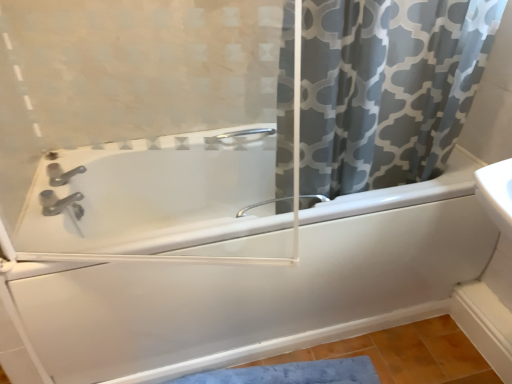
Describe the element at coordinates (251, 291) in the screenshot. This screenshot has width=512, height=384. I see `white glossy bathtub at center` at that location.

What do you see at coordinates (61, 203) in the screenshot? The height and width of the screenshot is (384, 512). I see `satin nickel faucet at lower left` at bounding box center [61, 203].

Locate an element on the screen. This screenshot has width=512, height=384. satin nickel faucet at lower left is located at coordinates (61, 203).

The height and width of the screenshot is (384, 512). Describe the element at coordinates (261, 205) in the screenshot. I see `satin nickel faucet at center` at that location.

What are the coordinates of `white glossy bathtub at center` in the screenshot? It's located at (251, 291).

This screenshot has width=512, height=384. Find the location of `curtain located behind the transparent glass screen door at upper center`. curtain located behind the transparent glass screen door at upper center is located at coordinates (387, 88).

Based on their sizes in the image, would you say gray printed fabric curtain at upper right is bigger or smaller than transparent glass screen door at upper center?

gray printed fabric curtain at upper right is bigger than transparent glass screen door at upper center.

Between gray printed fabric curtain at upper right and transparent glass screen door at upper center, which one is positioned in front?

transparent glass screen door at upper center is in front.

Is satin nickel faucet at center positioned with its back to satin nickel faucet at lower left?

No, satin nickel faucet at center is not facing away from satin nickel faucet at lower left.

From the image's perspective, would you say satin nickel faucet at center is shown under satin nickel faucet at lower left?

Correct, satin nickel faucet at center appears lower than satin nickel faucet at lower left in the image.

Where is `faucet below the satin nickel faucet at lower left (from the image's perspective)`? Image resolution: width=512 pixels, height=384 pixels. faucet below the satin nickel faucet at lower left (from the image's perspective) is located at coordinates (261, 205).

In terms of width, does satin nickel faucet at center look wider or thinner when compared to satin nickel faucet at lower left?

Considering their sizes, satin nickel faucet at center looks slimmer than satin nickel faucet at lower left.

Who is more distant, satin nickel faucet at lower left or gray printed fabric curtain at upper right?

satin nickel faucet at lower left is behind.

Considering the sizes of satin nickel faucet at lower left and gray printed fabric curtain at upper right in the image, is satin nickel faucet at lower left taller or shorter than gray printed fabric curtain at upper right?

Clearly, satin nickel faucet at lower left is shorter compared to gray printed fabric curtain at upper right.

Is satin nickel faucet at lower left positioned with its back to gray printed fabric curtain at upper right?

satin nickel faucet at lower left is not turned away from gray printed fabric curtain at upper right.

Looking at this image, in terms of width, does satin nickel faucet at lower left look wider or thinner when compared to gray printed fabric curtain at upper right?

Considering their sizes, satin nickel faucet at lower left looks slimmer than gray printed fabric curtain at upper right.

Is gray printed fabric curtain at upper right inside satin nickel faucet at center?

No, gray printed fabric curtain at upper right is not inside satin nickel faucet at center.

From the image's perspective, is satin nickel faucet at center on gray printed fabric curtain at upper right?

Incorrect, from the image's perspective, satin nickel faucet at center is lower than gray printed fabric curtain at upper right.

Is satin nickel faucet at center taller than gray printed fabric curtain at upper right?

No, satin nickel faucet at center is not taller than gray printed fabric curtain at upper right.

Is point (322, 197) closer to camera compared to point (431, 11)?

No, (322, 197) is further to viewer.

From a real-world perspective, who is located higher, transparent glass screen door at upper center or satin nickel faucet at center?

transparent glass screen door at upper center.

Considering the sizes of transparent glass screen door at upper center and satin nickel faucet at center in the image, is transparent glass screen door at upper center taller or shorter than satin nickel faucet at center?

transparent glass screen door at upper center is taller than satin nickel faucet at center.

From the picture: Considering the sizes of objects satin nickel faucet at lower left and white glossy bathtub at center in the image provided, who is bigger, satin nickel faucet at lower left or white glossy bathtub at center?

white glossy bathtub at center is bigger.

Is satin nickel faucet at lower left positioned with its back to white glossy bathtub at center?

No, satin nickel faucet at lower left is not facing away from white glossy bathtub at center.

Measure the distance from satin nickel faucet at lower left to white glossy bathtub at center.

22.12 inches.

Which is nearer, (x=249, y=205) or (x=140, y=197)?

Result: The point (x=140, y=197) is more forward.

Is satin nickel faucet at center oriented away from transparent glass screen door at upper center?

No, satin nickel faucet at center is not facing the opposite direction of transparent glass screen door at upper center.

Is satin nickel faucet at center not inside transparent glass screen door at upper center?

Yes, satin nickel faucet at center is located beyond the bounds of transparent glass screen door at upper center.

Find the location of a particular element. screen door on the left of the gray printed fabric curtain at upper right is located at coordinates (161, 193).

Where is `tap that appears above the satin nickel faucet at center (from the image's perspective)`? The image size is (512, 384). tap that appears above the satin nickel faucet at center (from the image's perspective) is located at coordinates (61, 203).

Looking at the image, which one is located further to satin nickel faucet at center, satin nickel faucet at lower left or gray printed fabric curtain at upper right?

satin nickel faucet at lower left lies further to satin nickel faucet at center than the other object.

From the picture: Which object lies further to the anchor point white glossy bathtub at center, satin nickel faucet at center or gray printed fabric curtain at upper right?

Among the two, satin nickel faucet at center is located further to white glossy bathtub at center.

Based on their spatial positions, is transparent glass screen door at upper center or gray printed fabric curtain at upper right closer to satin nickel faucet at center?

gray printed fabric curtain at upper right.

When comparing their distances from transparent glass screen door at upper center, does satin nickel faucet at center or satin nickel faucet at lower left seem closer?

satin nickel faucet at lower left is positioned closer to the anchor transparent glass screen door at upper center.

Looking at the image, which one is located closer to satin nickel faucet at lower left, satin nickel faucet at center or gray printed fabric curtain at upper right?

satin nickel faucet at center is closer to satin nickel faucet at lower left.

Which object lies nearer to the anchor point transparent glass screen door at upper center, white glossy bathtub at center or gray printed fabric curtain at upper right?

white glossy bathtub at center lies closer to transparent glass screen door at upper center than the other object.

Which object lies further to the anchor point satin nickel faucet at center, white glossy bathtub at center or gray printed fabric curtain at upper right?

white glossy bathtub at center lies further to satin nickel faucet at center than the other object.

Looking at the image, which one is located closer to satin nickel faucet at center, transparent glass screen door at upper center or white glossy bathtub at center?

white glossy bathtub at center is positioned closer to the anchor satin nickel faucet at center.

You are a GUI agent. You are given a task and a screenshot of the screen. Output one action in this format:
    pyautogui.click(x=<x>, y=<y>)
    Task: Click on the screen door located between satin nickel faucet at lower left and gray printed fabric curtain at upper right in the left-right direction
    The image size is (512, 384).
    Given the screenshot: What is the action you would take?
    pyautogui.click(x=161, y=193)

The image size is (512, 384). I want to click on bathtub located between satin nickel faucet at lower left and satin nickel faucet at center in the left-right direction, so click(x=251, y=291).

Image resolution: width=512 pixels, height=384 pixels. In order to click on faucet between satin nickel faucet at lower left and gray printed fabric curtain at upper right in this screenshot , I will do `click(261, 205)`.

Where is `faucet between transparent glass screen door at upper center and gray printed fabric curtain at upper right`? The image size is (512, 384). faucet between transparent glass screen door at upper center and gray printed fabric curtain at upper right is located at coordinates (261, 205).